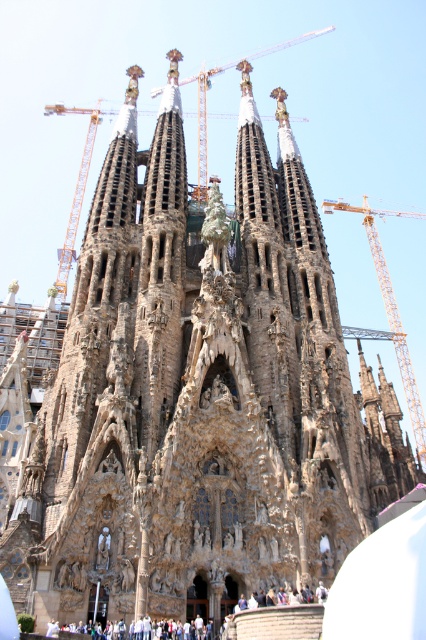
You are standing in front of the Sagrada Familia and want to take a photo that includes both the point at coordinates point [77,198] and point [66,637]. Which point should you focus on to ensure both are in sharp focus?

You should focus on point [77,198] because it is closer to the camera than point [66,637], ensuring both are within the depth of field.

You are a tourist standing at the Sagrada Familia, looking at the orange metallic crane at upper center and the white cotton shirt at lower center. Which object is higher in the image?

The orange metallic crane at upper center is higher in the image than the white cotton shirt at lower center.

You are standing in front of the Sagrada Familia and want to reach the point at coordinates point (x=302, y=35). Considering the basilica is 558 feet tall, is the point above or below the highest spire?

The point at (x=302, y=35) is 763.84 feet away from the viewer. Since the Sagrada Familia is 558 feet tall, the point is above the highest spire because it is farther away than the height of the basilica.